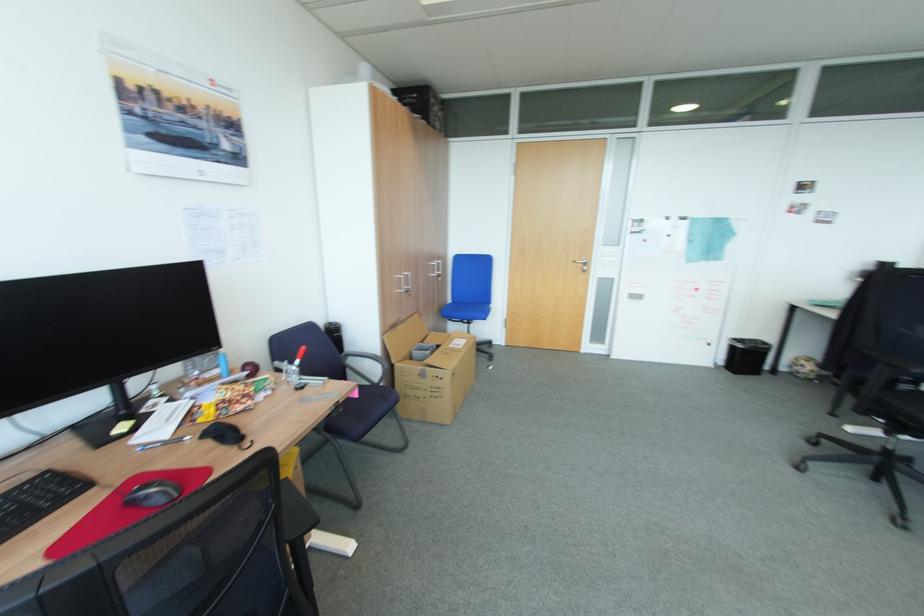
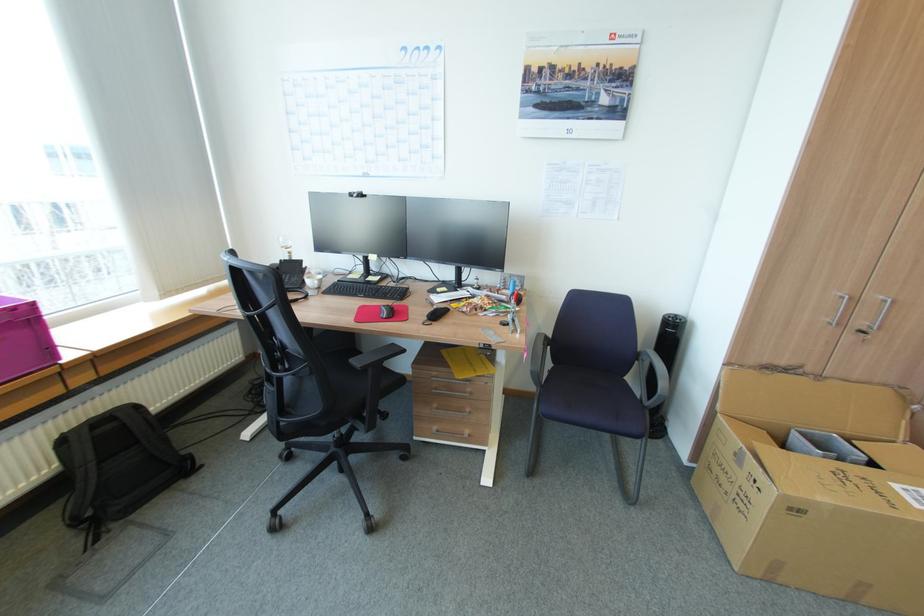
Find the pixel in the second image that matches point (459, 374) in the first image.

(804, 511)